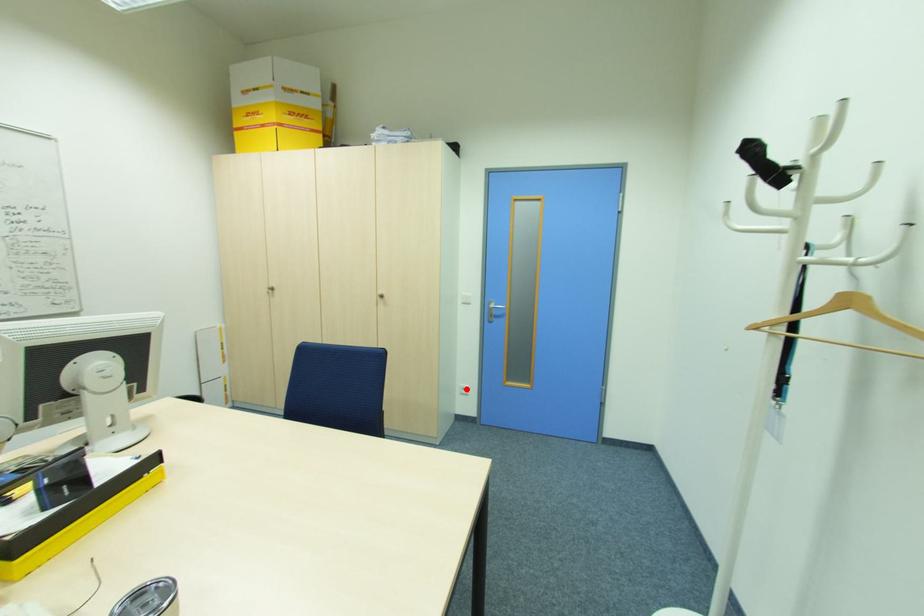
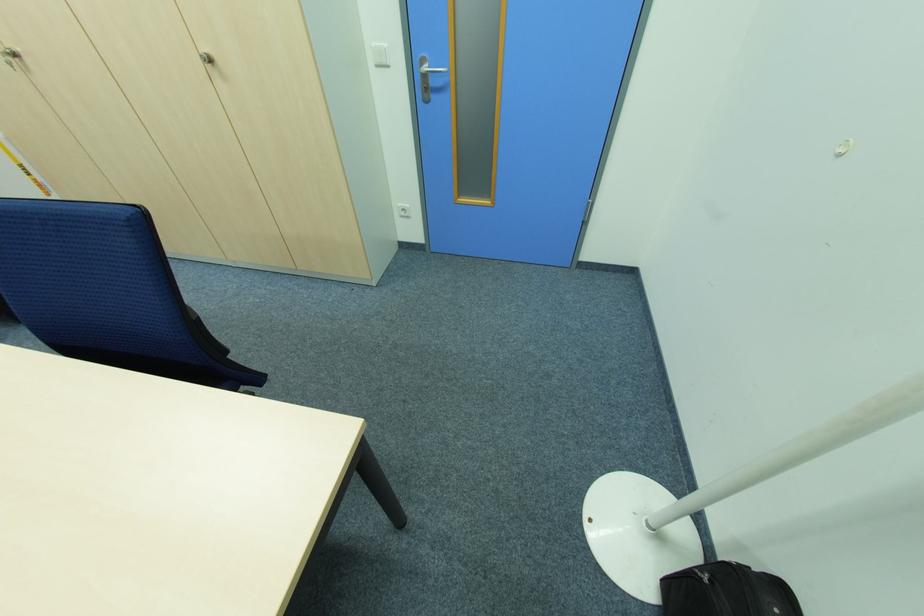
Where in the second image is the point corresponding to the highlighted location from the first image?

(407, 209)